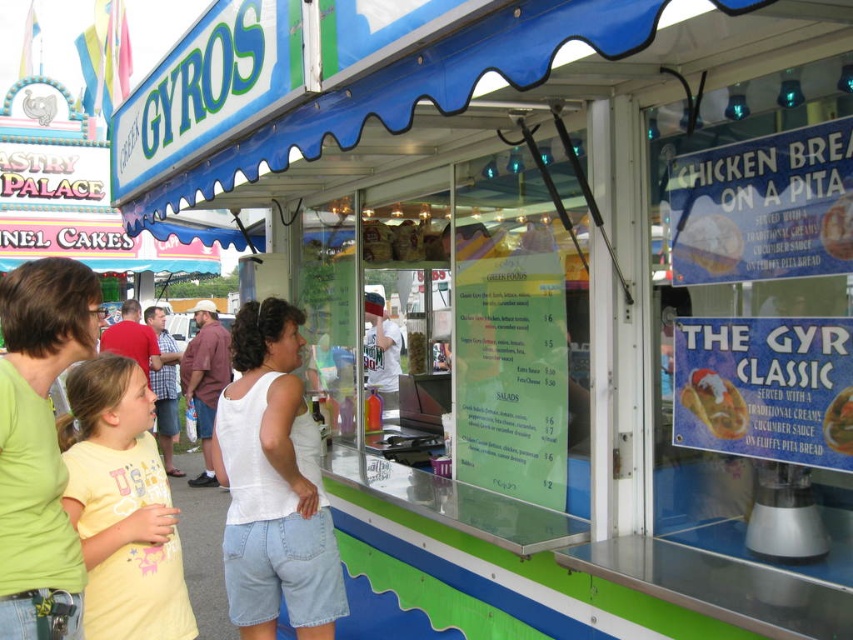
Question: Estimate the real-world distances between objects in this image. Which object is closer to the white cotton tank top at center?

Choices:
 (A) yellow matte shirt at lower left
 (B) smooth plastic cup at center
 (C) red shirt at center
 (D) matte plastic gyro at center right

Answer: (A)

Question: Which object is closer to the camera taking this photo?

Choices:
 (A) matte plastic chicken at center
 (B) green cotton shirt at left

Answer: (B)

Question: Is matte plastic gyro at center right to the right of smooth plastic cup at center from the viewer's perspective?

Choices:
 (A) no
 (B) yes

Answer: (A)

Question: Does red shirt at center appear under matte plastic chicken at center?

Choices:
 (A) yes
 (B) no

Answer: (A)

Question: Among these points, which one is nearest to the camera?

Choices:
 (A) (734, 259)
 (B) (163, 349)
 (C) (316, 531)

Answer: (A)

Question: Is red shirt at center further to the viewer compared to matte plastic chicken at center?

Choices:
 (A) no
 (B) yes

Answer: (B)